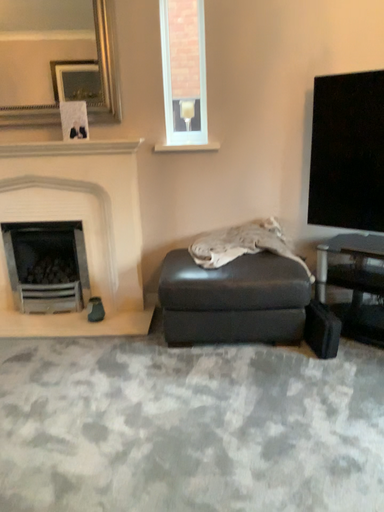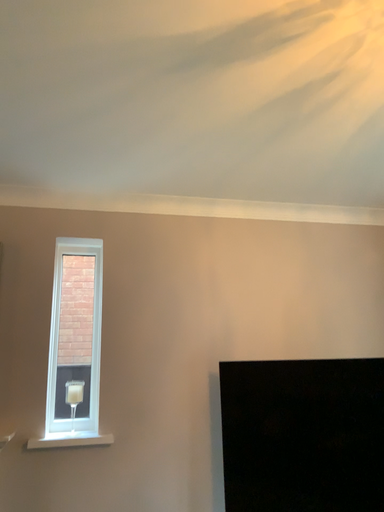
Question: How did the camera likely rotate when shooting the video?

Choices:
 (A) rotated downward
 (B) rotated upward

Answer: (B)